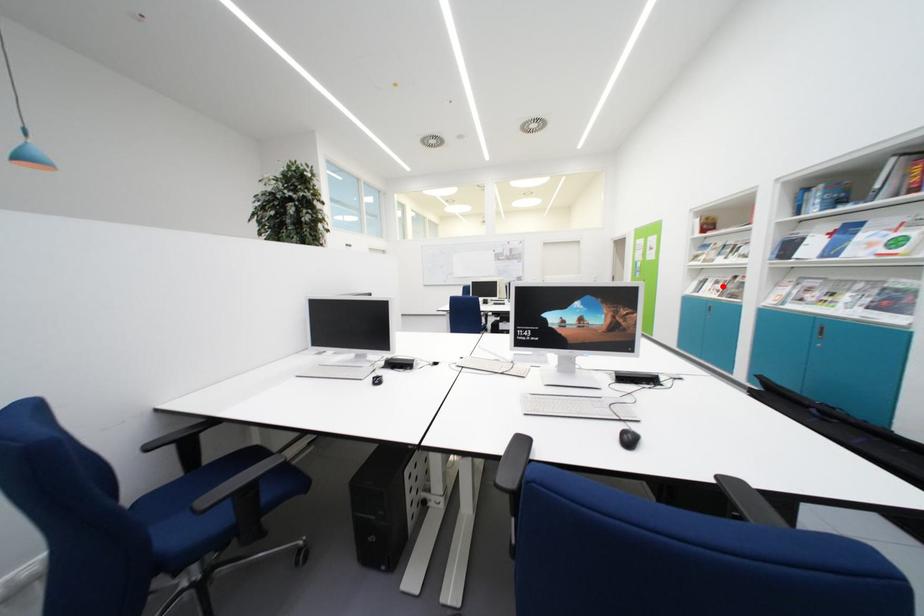
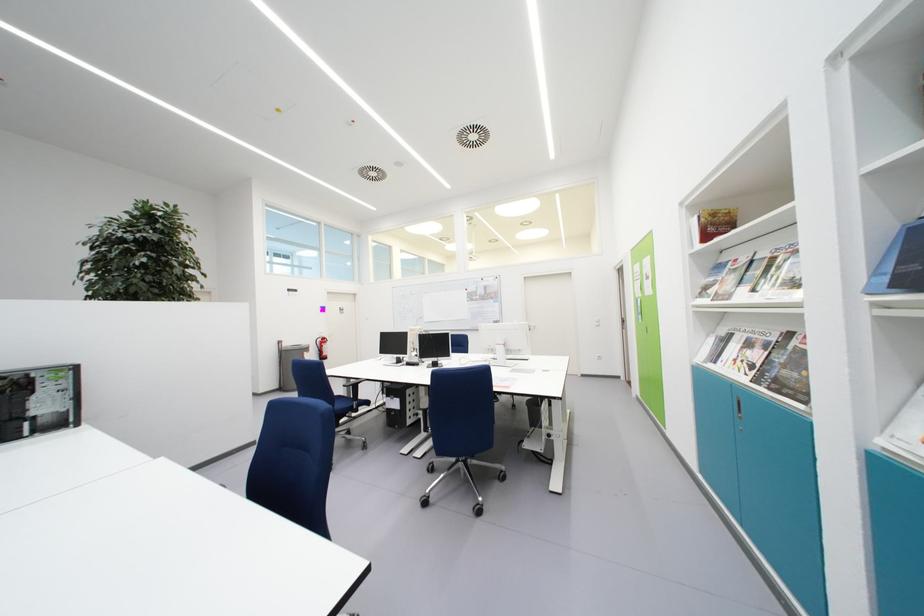
Where in the second image is the point corresponding to the highlighted location from the first image?

(755, 349)